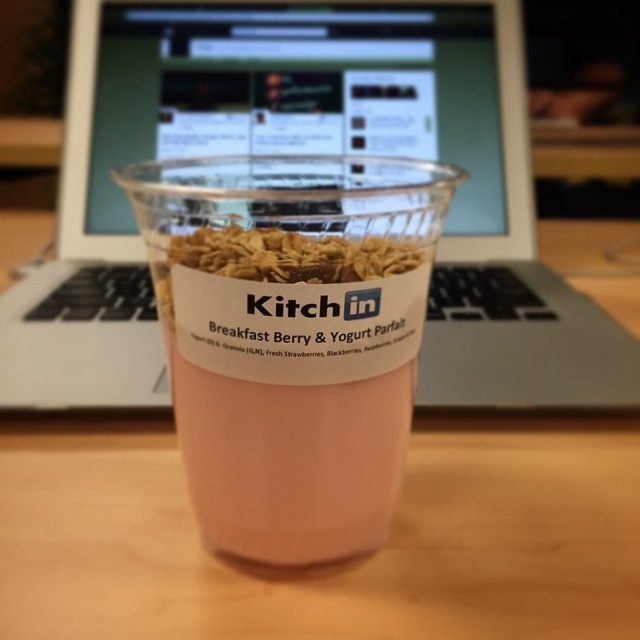
Does wooden table at center appear on the right side of pink translucent cup at center?

Correct, you'll find wooden table at center to the right of pink translucent cup at center.

Where is `wooden table at center`? wooden table at center is located at coordinates (330, 563).

Who is positioned more to the left, sleek silver laptop at center or wooden table at center?

From the viewer's perspective, sleek silver laptop at center appears more on the left side.

Based on the photo, who is positioned more to the right, sleek silver laptop at center or wooden table at center?

wooden table at center is more to the right.

Which is in front, point (268, 131) or point (253, 570)?

Point (253, 570)

Locate an element on the screen. Image resolution: width=640 pixels, height=640 pixels. sleek silver laptop at center is located at coordinates (307, 150).

Is sleek silver laptop at center behind pink translucent cup at center?

Yes, sleek silver laptop at center is behind pink translucent cup at center.

I want to click on sleek silver laptop at center, so click(307, 150).

You are a GUI agent. You are given a task and a screenshot of the screen. Output one action in this format:
    pyautogui.click(x=<x>, y=<y>)
    Task: Click on the sleek silver laptop at center
    The image size is (640, 640).
    Given the screenshot: What is the action you would take?
    pyautogui.click(x=307, y=150)